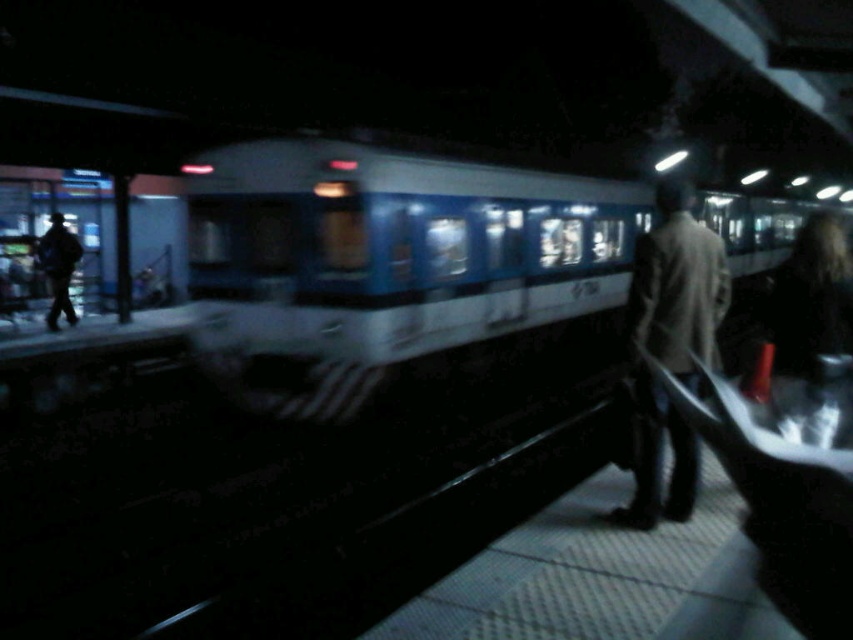
Who is shorter, blue/white metal train at center or dark gray coat at left?

dark gray coat at left is shorter.

Does point (375, 237) come closer to viewer compared to point (56, 243)?

Yes, it is.

Describe the element at coordinates (387, 264) in the screenshot. Image resolution: width=853 pixels, height=640 pixels. I see `blue/white metal train at center` at that location.

Where is `blue/white metal train at center`? The image size is (853, 640). blue/white metal train at center is located at coordinates (387, 264).

Does blue/white metal train at center have a lesser width compared to light brown leather jacket at center?

Incorrect, blue/white metal train at center's width is not less than light brown leather jacket at center's.

Which of these two, blue/white metal train at center or light brown leather jacket at center, stands shorter?

light brown leather jacket at center is shorter.

Is point (476, 172) closer to camera compared to point (670, 321)?

No, (476, 172) is behind (670, 321).

The width and height of the screenshot is (853, 640). Identify the location of blue/white metal train at center. [x=387, y=264].

The height and width of the screenshot is (640, 853). What do you see at coordinates (670, 346) in the screenshot?
I see `light brown leather jacket at center` at bounding box center [670, 346].

Is point (643, 472) closer to viewer compared to point (45, 257)?

That is True.

Identify the location of light brown leather jacket at center. The width and height of the screenshot is (853, 640). (670, 346).